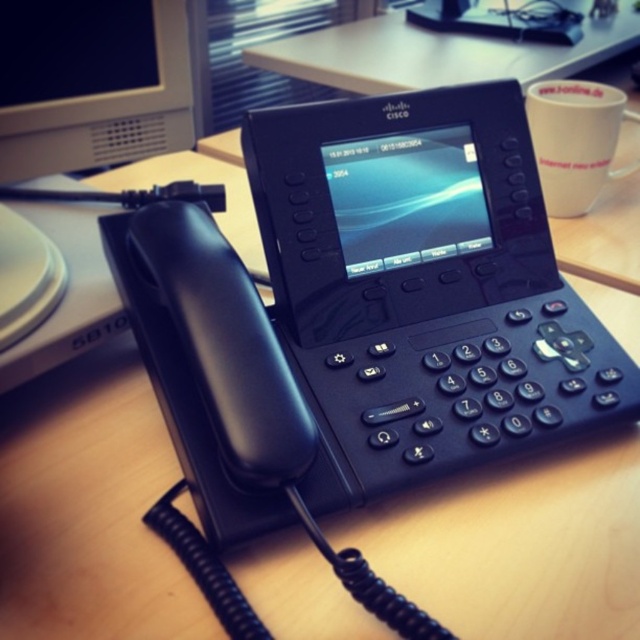
You are a delivery person placing a white glossy mug at upper right on a wooden table at center. Can you confirm if the mug will be visible from the front of the table?

The wooden table at center is positioned over the white glossy mug at upper right, which means the mug is underneath the table. Therefore, the mug will not be visible from the front of the table.

You are standing in front of the Cisco IP phone on the desk. There are two points marked on the phone. The first point is at coordinates point [362,84] and the second point is at point [627,173]. Which point is closer to you?

Point [627,173] is closer to you because it is less further to the camera than point [362,84].

You are a delivery robot that needs to place a 10 cm wide package on the wooden table at center without knocking over the white glossy mug at upper right. Can you fit the package between them?

The wooden table at center and white glossy mug at upper right are 46.84 centimeters apart from each other. Since the package is only 10 cm wide, there is enough space between them to place the package safely without knocking over the mug.